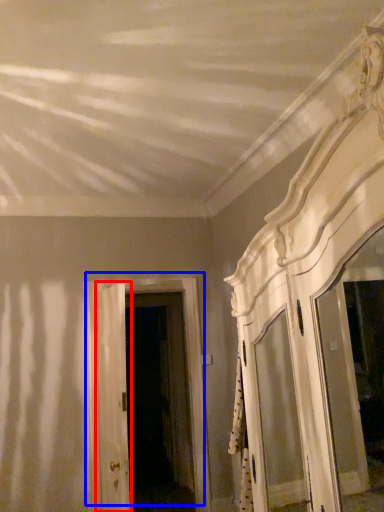
Question: Among these objects, which one is nearest to the camera, door (highlighted by a red box) or door (highlighted by a blue box)?

Choices:
 (A) door
 (B) door

Answer: (A)